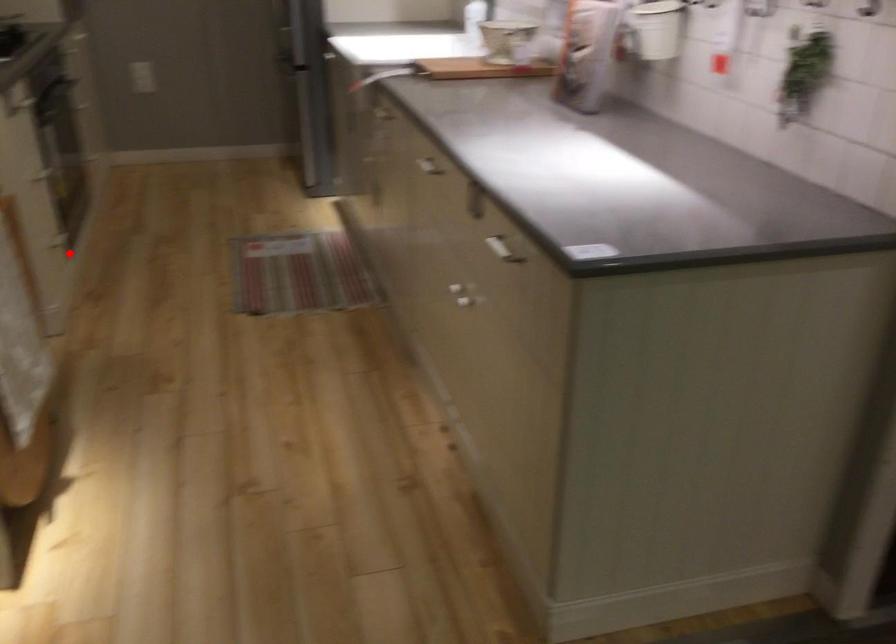
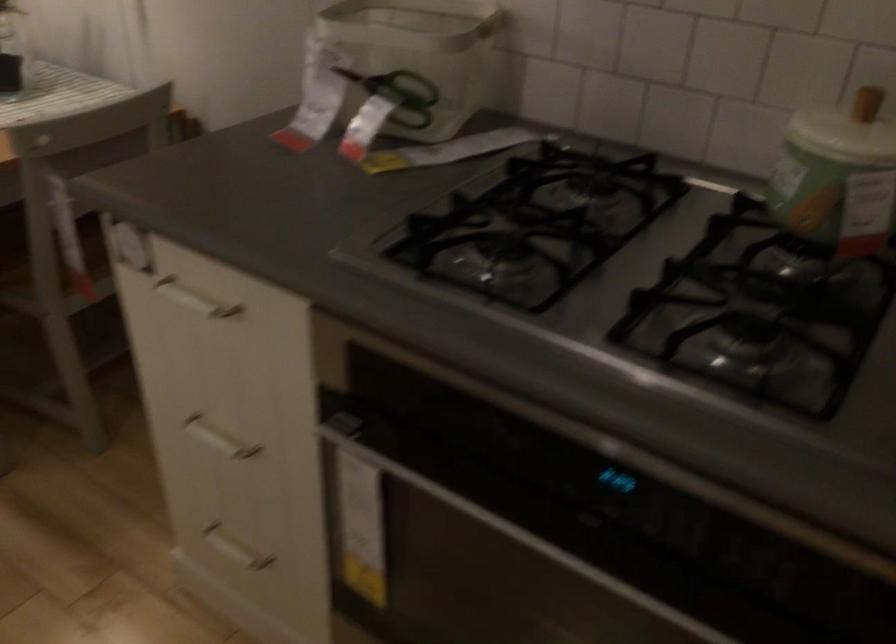
Question: I am providing you with two images of the same scene from different viewpoints. In image1, a red point is highlighted. Considering the same 3D point in image2, which of the following is correct?

Choices:
 (A) It is closer
 (B) It is farther

Answer: (A)